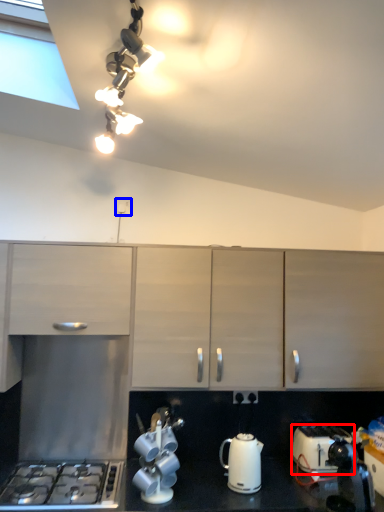
Question: Which point is closer to the camera, toaster (highlighted by a red box) or electric outlet (highlighted by a blue box)?

Choices:
 (A) toaster
 (B) electric outlet

Answer: (A)